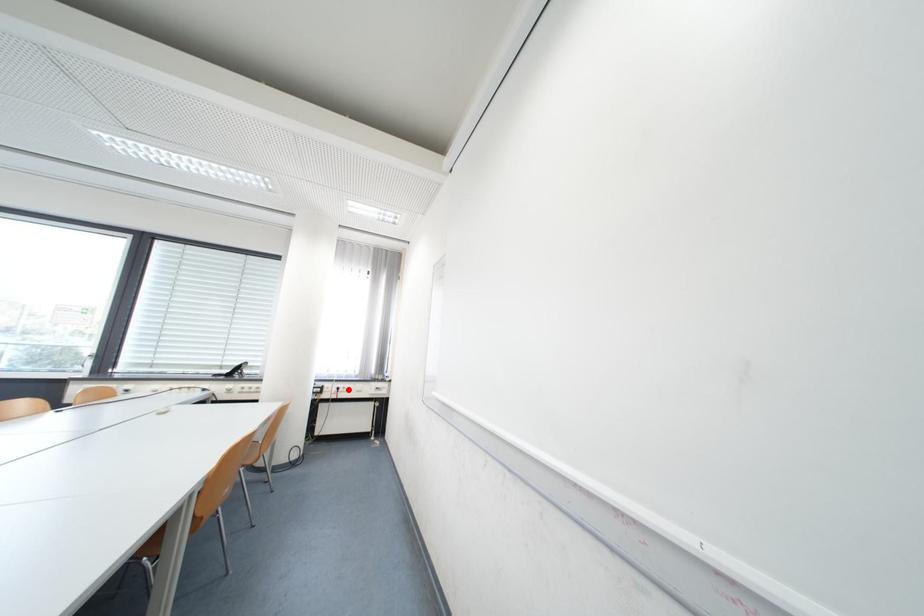
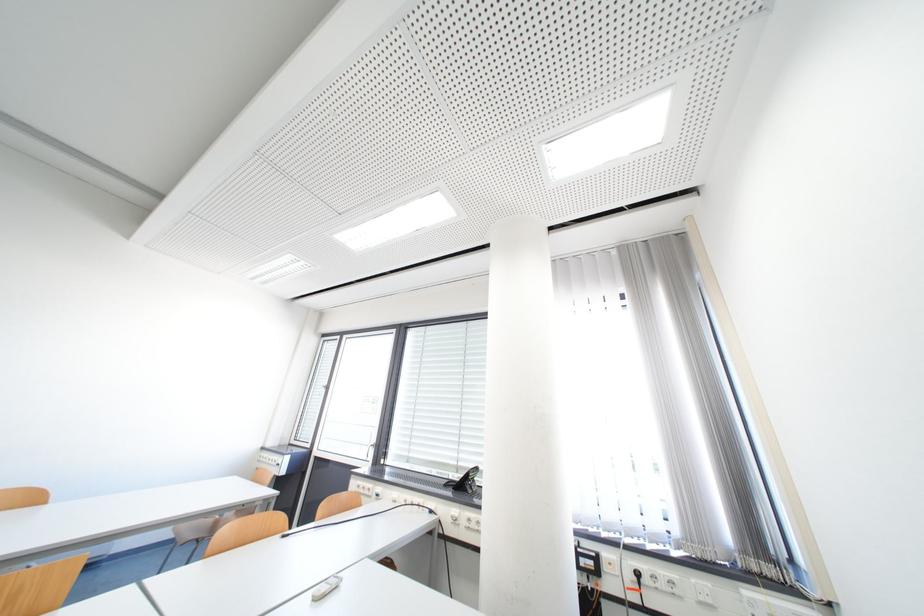
Locate, in the second image, the point that corresponds to the highlighted location in the first image.

(649, 576)